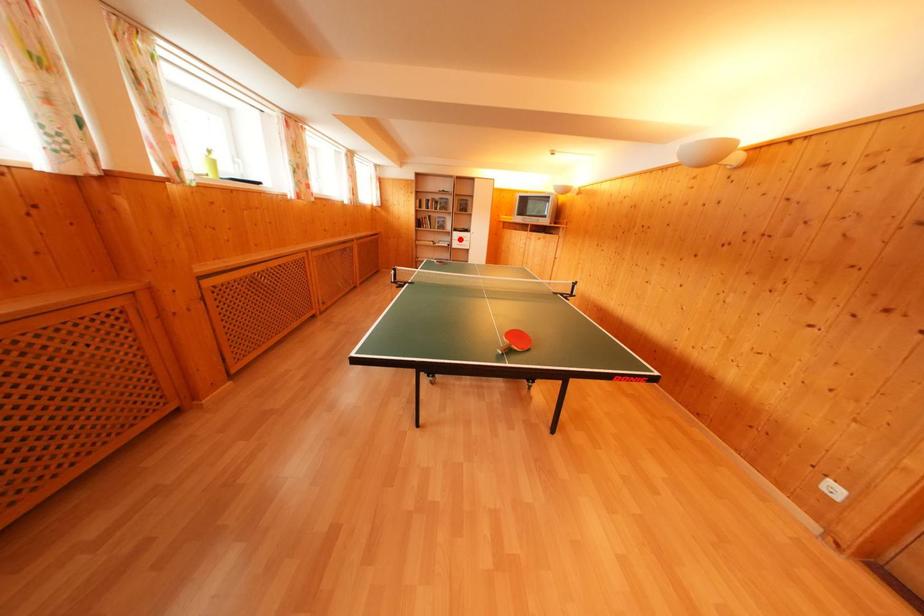
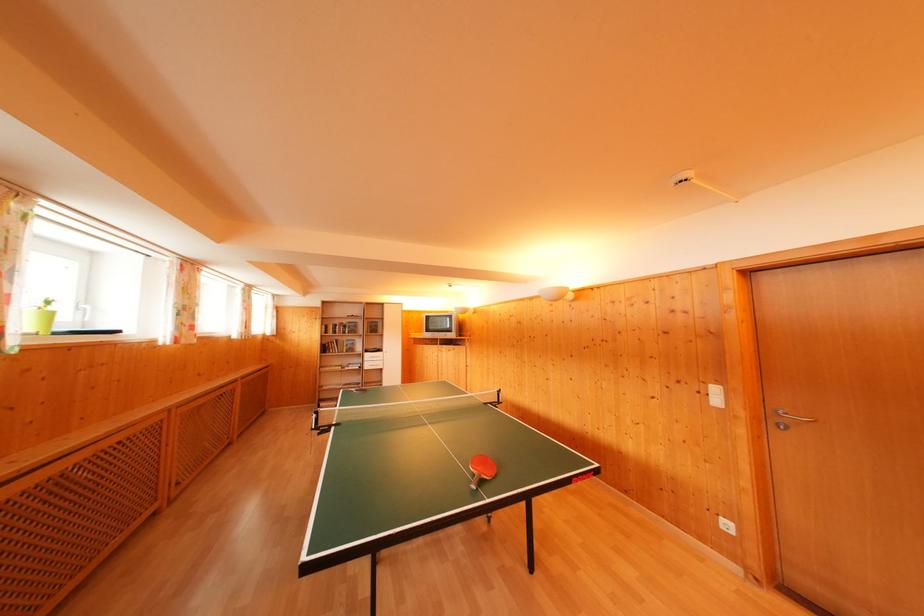
Locate, in the second image, the point that corresponds to the highlighted location in the first image.

(371, 360)